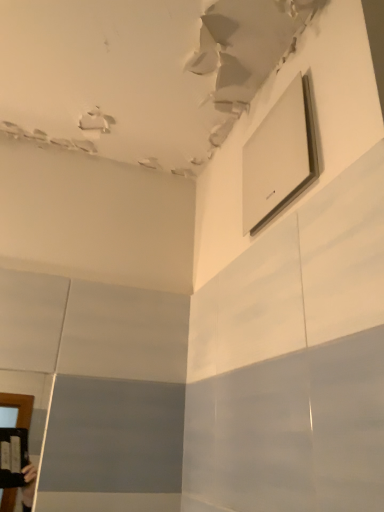
Question: Which direction should I rotate to look at white glossy medicine cabinet at upper center?

Choices:
 (A) right
 (B) left

Answer: (A)